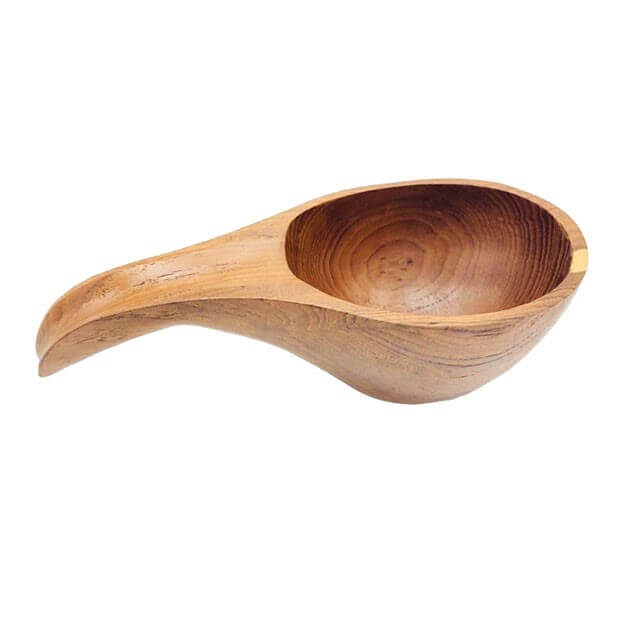
You are a GUI agent. You are given a task and a screenshot of the screen. Output one action in this format:
    pyautogui.click(x=<x>, y=<y>)
    Task: Click on the spoon
    Image resolution: width=640 pixels, height=640 pixels.
    Given the screenshot: What is the action you would take?
    coord(361,308)